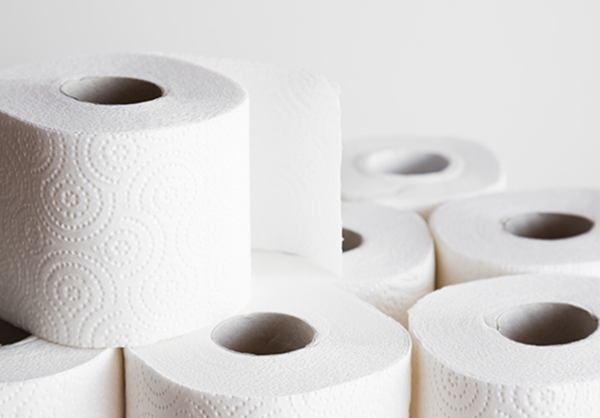
Where is `toilet paper`? This screenshot has height=418, width=600. toilet paper is located at coordinates (85, 402), (122, 264), (342, 357), (488, 359), (399, 239), (421, 188), (492, 239).